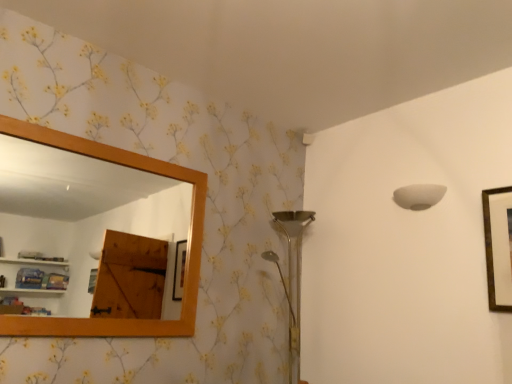
Question: Should I look upward or downward to see wooden frame mirror at upper left?

Choices:
 (A) down
 (B) up

Answer: (A)

Question: Is white matte lampshade at upper right bigger than wooden frame mirror at upper left?

Choices:
 (A) yes
 (B) no

Answer: (B)

Question: Is white matte lampshade at upper right facing towards wooden frame mirror at upper left?

Choices:
 (A) yes
 (B) no

Answer: (B)

Question: Is white matte lampshade at upper right in front of wooden frame mirror at upper left?

Choices:
 (A) no
 (B) yes

Answer: (A)

Question: From a real-world perspective, is white matte lampshade at upper right located higher than wooden frame mirror at upper left?

Choices:
 (A) no
 (B) yes

Answer: (B)

Question: From a real-world perspective, is white matte lampshade at upper right positioned under wooden frame mirror at upper left based on gravity?

Choices:
 (A) no
 (B) yes

Answer: (A)

Question: Considering the relative sizes of white matte lampshade at upper right and wooden frame mirror at upper left in the image provided, is white matte lampshade at upper right shorter than wooden frame mirror at upper left?

Choices:
 (A) yes
 (B) no

Answer: (A)

Question: From a real-world perspective, is wooden frame mirror at upper left beneath white matte lampshade at upper right?

Choices:
 (A) no
 (B) yes

Answer: (B)

Question: From the image's perspective, would you say wooden frame mirror at upper left is shown under white matte lampshade at upper right?

Choices:
 (A) yes
 (B) no

Answer: (A)

Question: Considering the relative sizes of wooden frame mirror at upper left and white matte lampshade at upper right in the image provided, is wooden frame mirror at upper left thinner than white matte lampshade at upper right?

Choices:
 (A) no
 (B) yes

Answer: (B)

Question: From the image's perspective, is wooden frame mirror at upper left on top of white matte lampshade at upper right?

Choices:
 (A) no
 (B) yes

Answer: (A)

Question: Is wooden frame mirror at upper left smaller than white matte lampshade at upper right?

Choices:
 (A) yes
 (B) no

Answer: (B)

Question: Can you confirm if wooden frame mirror at upper left is positioned to the right of white matte lampshade at upper right?

Choices:
 (A) yes
 (B) no

Answer: (B)

Question: Does wooden frame mirror at upper left lie in front of gold-framed picture at upper right?

Choices:
 (A) yes
 (B) no

Answer: (A)